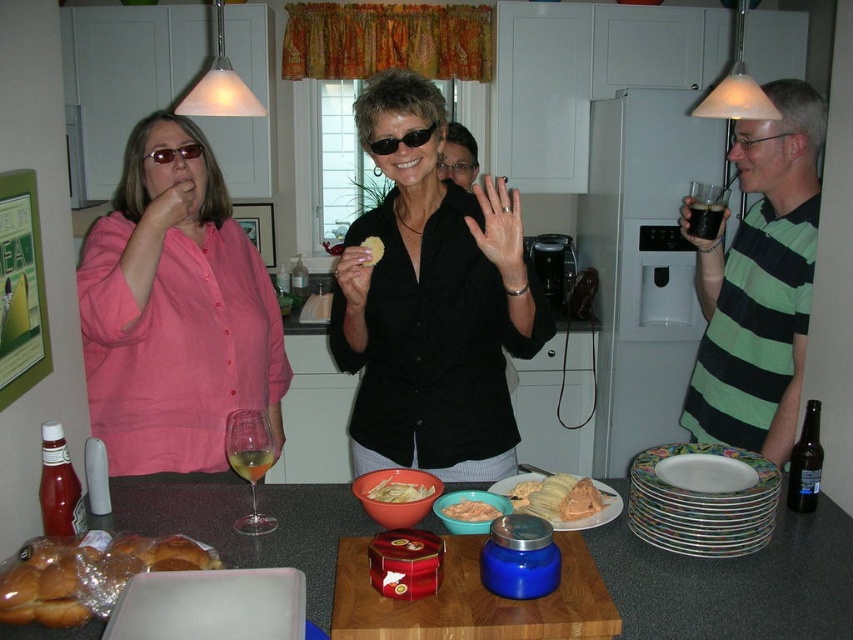
Question: Which point is farther from the camera taking this photo?

Choices:
 (A) (546, 486)
 (B) (90, 301)

Answer: (B)

Question: Among these points, which one is nearest to the camera?

Choices:
 (A) (99, 595)
 (B) (450, 516)

Answer: (A)

Question: Which object is closer to the camera taking this photo?

Choices:
 (A) translucent plastic bread at lower left
 (B) translucent glass wine glass at center
 (C) dark brown liquid at upper right
 (D) golden corn tamale at center

Answer: (A)

Question: Can you confirm if translucent glass wine glass at center is positioned above smooth orange dip at center?

Choices:
 (A) yes
 (B) no

Answer: (A)

Question: Is the position of translucent plastic bread at lower left less distant than that of golden corn tamale at center?

Choices:
 (A) yes
 (B) no

Answer: (A)

Question: Is the position of porcelain plate at center more distant than that of dark brown liquid at upper right?

Choices:
 (A) no
 (B) yes

Answer: (A)